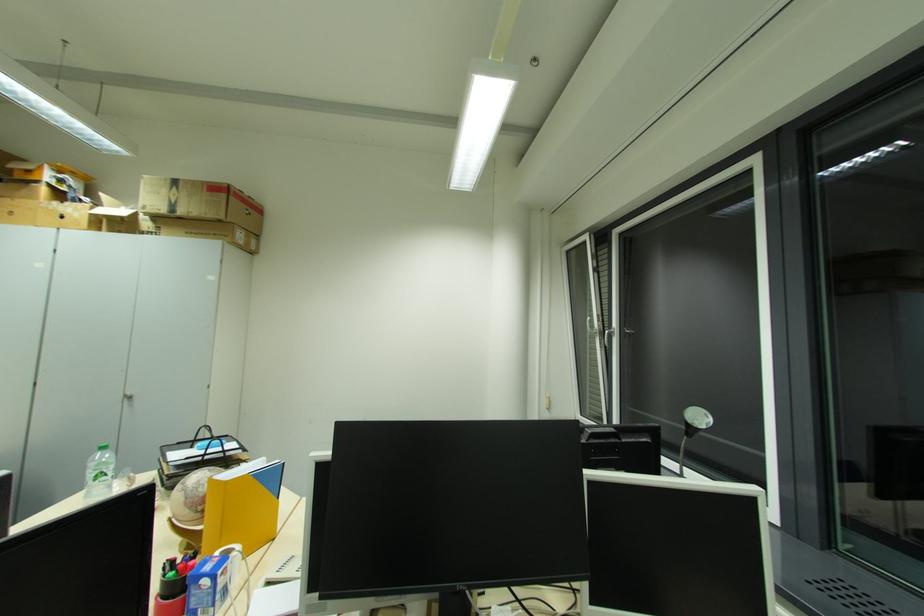
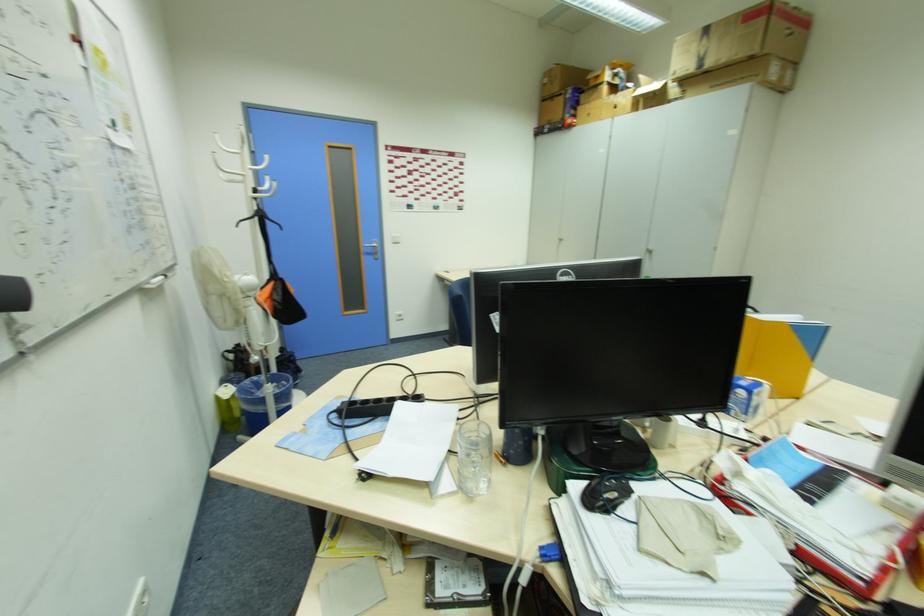
The point at (242, 548) is marked in the first image. Where is the corresponding point in the second image?

(772, 384)